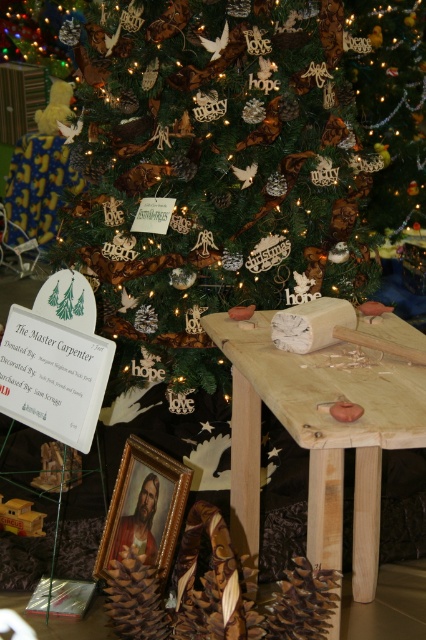
Measure the distance between point (264, 188) and camera.

Point (264, 188) is 5.78 feet from camera.

Which is above, green textured christmas tree at center or natural wood table at center?

Positioned higher is green textured christmas tree at center.

This screenshot has width=426, height=640. I want to click on green textured christmas tree at center, so click(213, 170).

Where is `green textured christmas tree at center`? This screenshot has width=426, height=640. green textured christmas tree at center is located at coordinates (213, 170).

Who is taller, natural wood table at center or brown matte pine cone at lower center?

natural wood table at center

What do you see at coordinates (317, 435) in the screenshot? The height and width of the screenshot is (640, 426). I see `natural wood table at center` at bounding box center [317, 435].

Identify the location of natural wood table at center. The height and width of the screenshot is (640, 426). (317, 435).

Between green textured christmas tree at center and brown matte pine cone at lower center, which one appears on the right side from the viewer's perspective?

Positioned to the right is green textured christmas tree at center.

Does point (305, 163) come farther from viewer compared to point (127, 554)?

Yes, it is behind point (127, 554).

You are a GUI agent. You are given a task and a screenshot of the screen. Output one action in this format:
    pyautogui.click(x=<x>, y=<y>)
    Task: Click on the green textured christmas tree at center
    This screenshot has width=426, height=640.
    Given the screenshot: What is the action you would take?
    pyautogui.click(x=213, y=170)